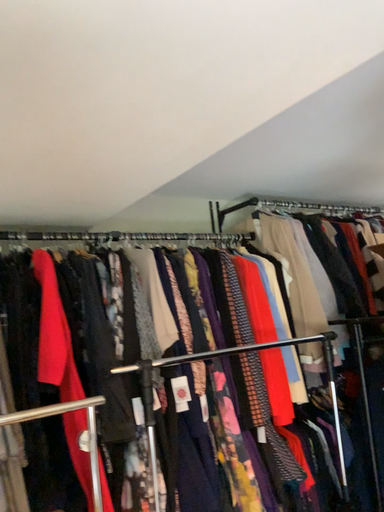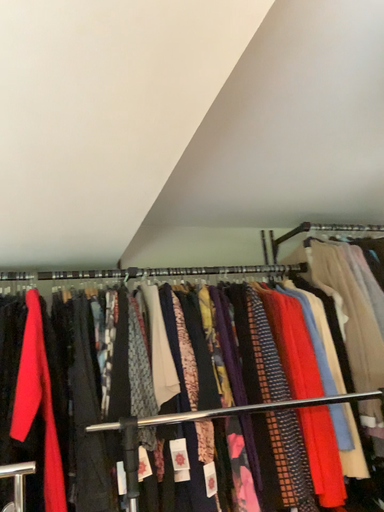
Question: How did the camera likely rotate when shooting the video?

Choices:
 (A) rotated left
 (B) rotated right

Answer: (A)